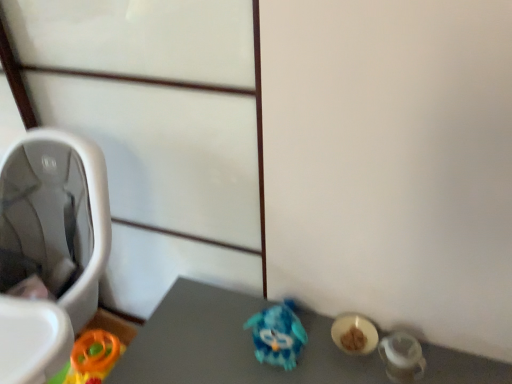
Locate an element on the screen. This screenshot has height=384, width=512. vacant space to the right of blue plastic toy at center is located at coordinates (328, 352).